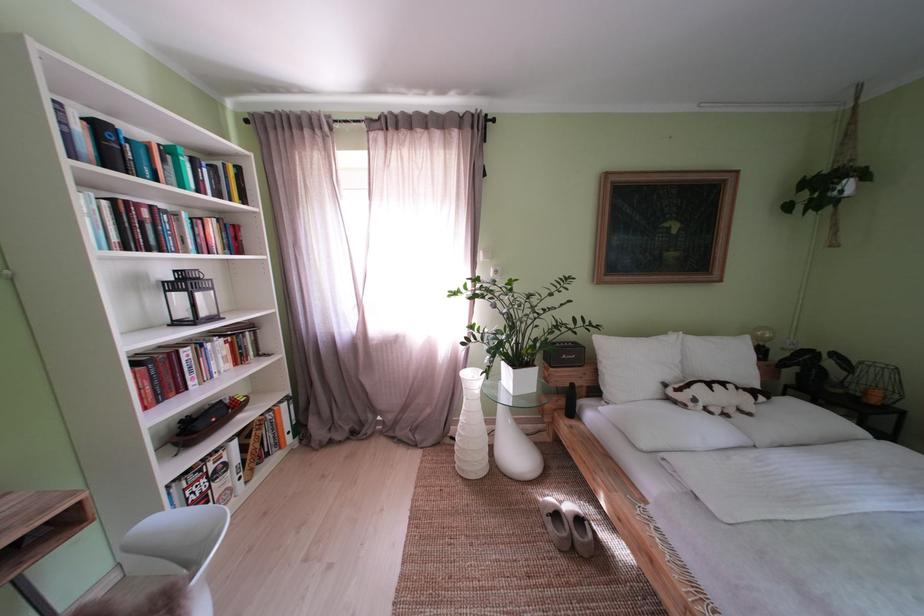
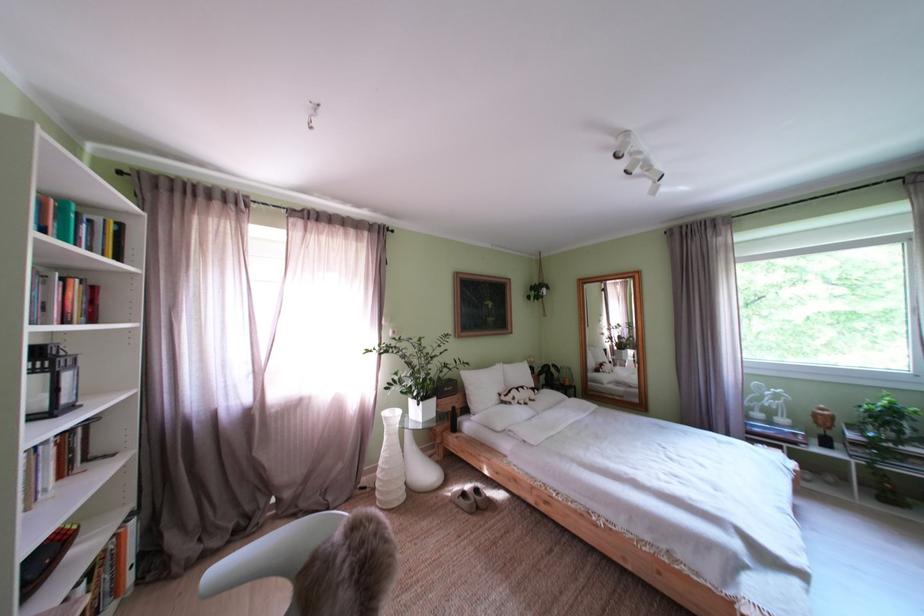
In the second image, find the point that corresponds to (567,521) in the first image.

(475, 500)